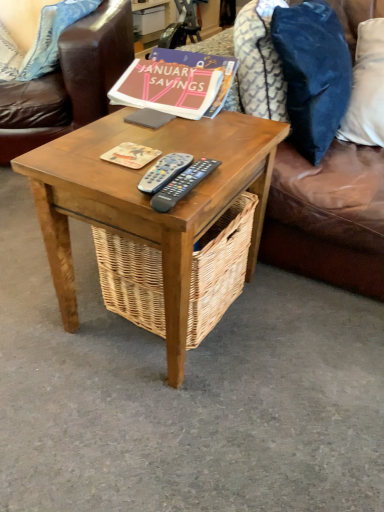
Question: Is wooden side table at center with blue fabric pillow at upper left, the first pillow in the left-to-right sequence?

Choices:
 (A) no
 (B) yes

Answer: (A)

Question: Can you confirm if wooden side table at center is thinner than blue fabric pillow at upper left, the fourth pillow in the right-to-left sequence?

Choices:
 (A) no
 (B) yes

Answer: (A)

Question: Can you confirm if wooden side table at center is positioned to the right of blue fabric pillow at upper left, the first pillow in the left-to-right sequence?

Choices:
 (A) yes
 (B) no

Answer: (A)

Question: Is wooden side table at center outside of blue fabric pillow at upper left, the first pillow in the left-to-right sequence?

Choices:
 (A) no
 (B) yes

Answer: (B)

Question: Is wooden side table at center further to camera compared to blue fabric pillow at upper left, the fourth pillow in the right-to-left sequence?

Choices:
 (A) no
 (B) yes

Answer: (A)

Question: From a real-world perspective, is wooden side table at center located beneath blue fabric pillow at upper left, the first pillow in the left-to-right sequence?

Choices:
 (A) no
 (B) yes

Answer: (B)

Question: Is wooden side table at center shorter than blue fabric pillow at upper left, the 3th pillow from the right?

Choices:
 (A) no
 (B) yes

Answer: (A)

Question: Is wooden side table at center facing towards blue fabric pillow at upper left, positioned as the 2th pillow in left-to-right order?

Choices:
 (A) no
 (B) yes

Answer: (A)

Question: Is wooden side table at center next to blue fabric pillow at upper left, positioned as the 2th pillow in left-to-right order?

Choices:
 (A) yes
 (B) no

Answer: (B)

Question: Can we say wooden side table at center lies outside blue fabric pillow at upper left, positioned as the 2th pillow in left-to-right order?

Choices:
 (A) yes
 (B) no

Answer: (A)

Question: Considering the relative sizes of wooden side table at center and blue fabric pillow at upper left, positioned as the 2th pillow in left-to-right order, in the image provided, is wooden side table at center bigger than blue fabric pillow at upper left, positioned as the 2th pillow in left-to-right order,?

Choices:
 (A) no
 (B) yes

Answer: (B)

Question: From the image's perspective, is wooden side table at center on top of blue fabric pillow at upper left, the 3th pillow from the right?

Choices:
 (A) yes
 (B) no

Answer: (B)

Question: Can you confirm if matte cardboard coaster at center, acting as the second book starting from the top, is taller than blue fabric pillow at upper left, positioned as the 2th pillow in left-to-right order?

Choices:
 (A) yes
 (B) no

Answer: (B)